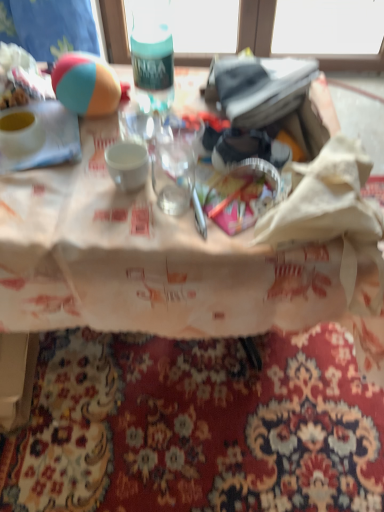
Where is `vacant area situated to the left side of translucent plastic cup at center`? The image size is (384, 512). vacant area situated to the left side of translucent plastic cup at center is located at coordinates (147, 206).